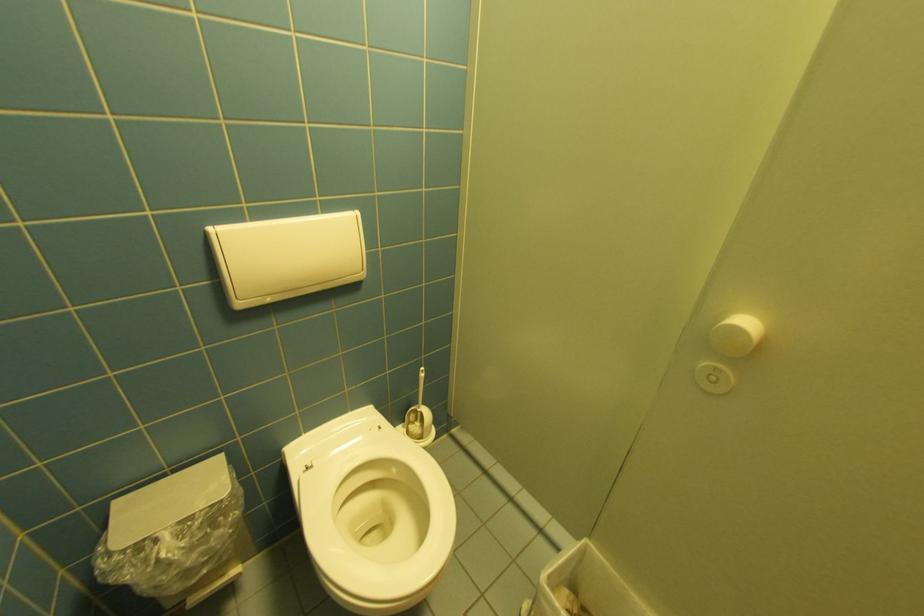
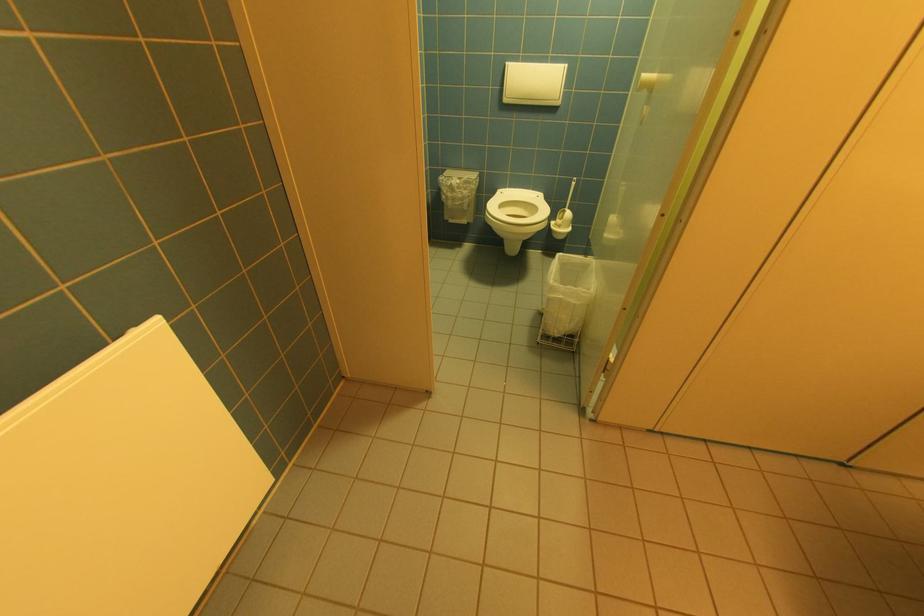
Where in the second image is the point corresponding to point 311,432 from the first image?

(515, 188)